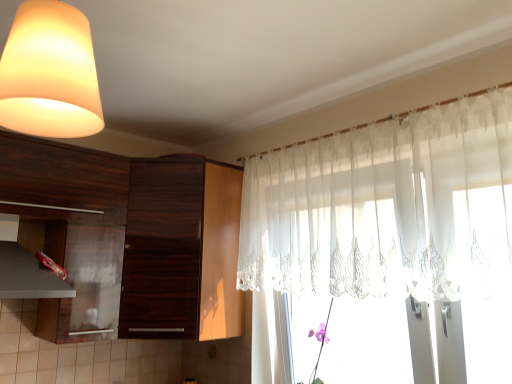
Question: In which direction should I rotate to look at dark wood cabinet at center, which appears as the first cabinetry when viewed from the right?

Choices:
 (A) left
 (B) right

Answer: (A)

Question: From the image's perspective, does dark wood cabinet at center, placed as the second cabinetry when sorted from left to right, appear higher than matte black exhaust hood at lower left?

Choices:
 (A) no
 (B) yes

Answer: (A)

Question: Is dark wood cabinet at center, which appears as the first cabinetry when viewed from the right, in contact with matte black exhaust hood at lower left?

Choices:
 (A) no
 (B) yes

Answer: (A)

Question: Can you confirm if dark wood cabinet at center, placed as the second cabinetry when sorted from left to right, is thinner than matte black exhaust hood at lower left?

Choices:
 (A) yes
 (B) no

Answer: (B)

Question: Is dark wood cabinet at center, which appears as the first cabinetry when viewed from the right, oriented towards matte black exhaust hood at lower left?

Choices:
 (A) yes
 (B) no

Answer: (B)

Question: Is dark wood cabinet at center, which appears as the first cabinetry when viewed from the right, bigger than matte black exhaust hood at lower left?

Choices:
 (A) yes
 (B) no

Answer: (A)

Question: Are dark wood cabinet at center, placed as the second cabinetry when sorted from left to right, and matte black exhaust hood at lower left located far from each other?

Choices:
 (A) yes
 (B) no

Answer: (B)

Question: From a real-world perspective, is dark wood cabinet at center, placed as the second cabinetry when sorted from left to right, under matte white lampshade at upper left?

Choices:
 (A) no
 (B) yes

Answer: (B)

Question: Is dark wood cabinet at center, which appears as the first cabinetry when viewed from the right, positioned with its back to matte white lampshade at upper left?

Choices:
 (A) yes
 (B) no

Answer: (B)

Question: Is dark wood cabinet at center, placed as the second cabinetry when sorted from left to right, outside matte white lampshade at upper left?

Choices:
 (A) yes
 (B) no

Answer: (A)

Question: Is dark wood cabinet at center, placed as the second cabinetry when sorted from left to right, to the left of matte white lampshade at upper left from the viewer's perspective?

Choices:
 (A) yes
 (B) no

Answer: (A)

Question: Does dark wood cabinet at center, placed as the second cabinetry when sorted from left to right, lie in front of matte white lampshade at upper left?

Choices:
 (A) no
 (B) yes

Answer: (A)

Question: From a real-world perspective, does dark wood cabinet at center, which appears as the first cabinetry when viewed from the right, stand above matte white lampshade at upper left?

Choices:
 (A) yes
 (B) no

Answer: (B)

Question: Is sheer white curtain at upper right in front of matte black exhaust hood at lower left?

Choices:
 (A) yes
 (B) no

Answer: (A)